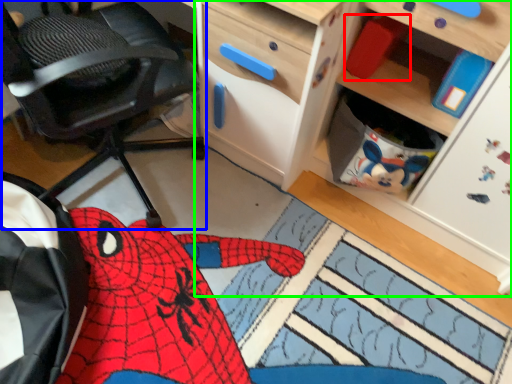
Question: Estimate the real-world distances between objects in this image. Which object is closer to toy (highlighted by a red box), chair (highlighted by a blue box) or cabinetry (highlighted by a green box)?

Choices:
 (A) chair
 (B) cabinetry

Answer: (B)